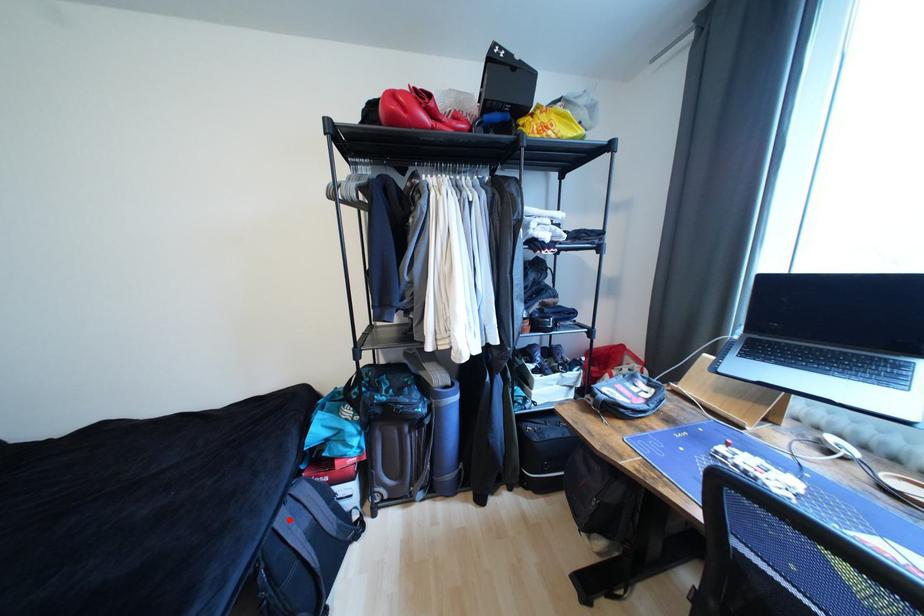
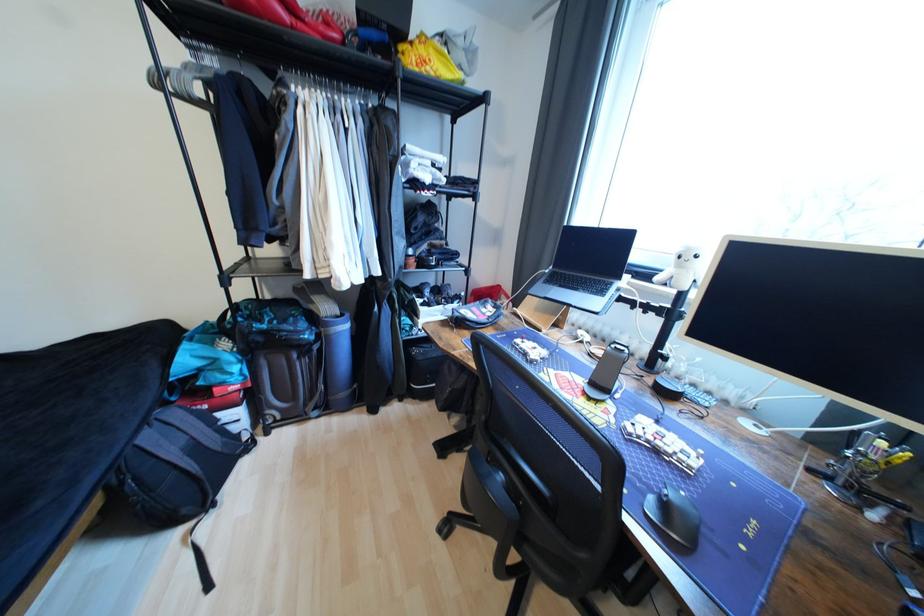
Find the pixel in the second image that matches the highlighted location in the first image.

(155, 439)